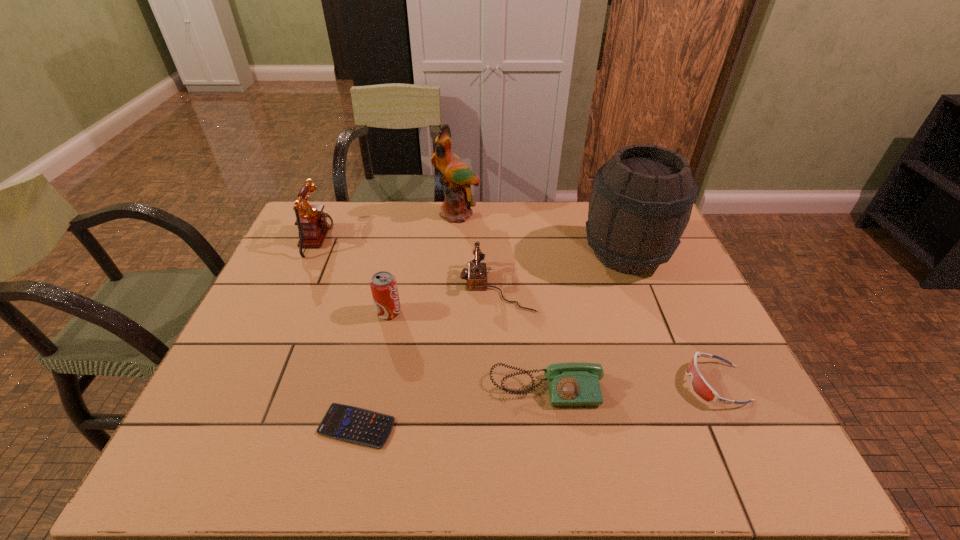
The width and height of the screenshot is (960, 540). In order to click on object present at the far left corner in this screenshot , I will do `click(313, 224)`.

Locate an element on the screen. The image size is (960, 540). object positioned at the far right corner is located at coordinates (641, 203).

In the image, there is a desktop. Where is `free space at the far edge`? This screenshot has width=960, height=540. free space at the far edge is located at coordinates (456, 227).

Locate an element on the screen. vacant region at the near edge of the desktop is located at coordinates (455, 470).

In the image, there is a desktop. Where is `vacant space at the left edge`? The image size is (960, 540). vacant space at the left edge is located at coordinates (294, 294).

Locate an element on the screen. blank space at the right edge of the desktop is located at coordinates (714, 339).

The height and width of the screenshot is (540, 960). Identify the location of vacant point at the near left corner. (245, 455).

Find the location of a particular element. free spot between the calculator and the wine bucket is located at coordinates (492, 340).

Find the location of `free space between the soda can and the shortest telephone`. free space between the soda can and the shortest telephone is located at coordinates (468, 350).

Where is `free spot between the goggles and the wine bucket`? This screenshot has width=960, height=540. free spot between the goggles and the wine bucket is located at coordinates (671, 319).